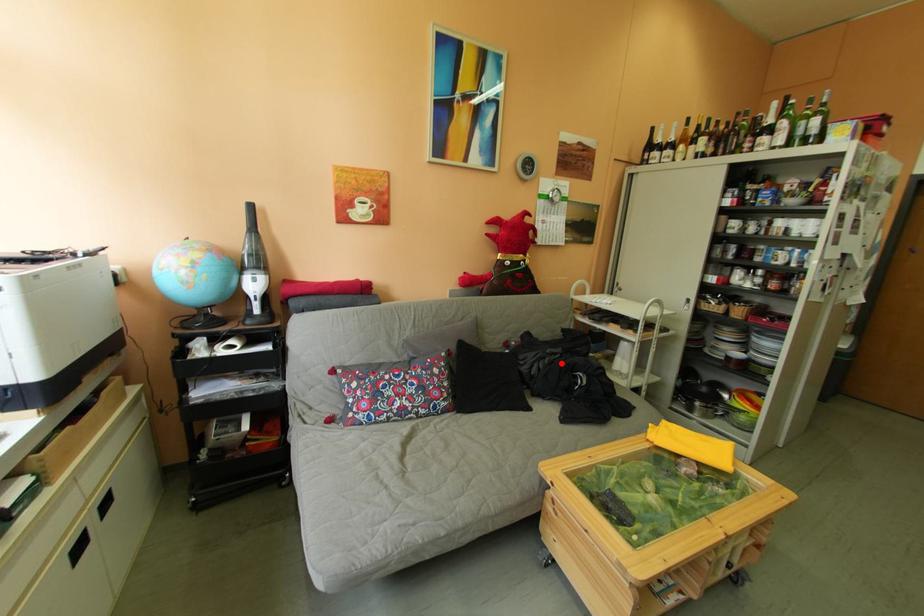
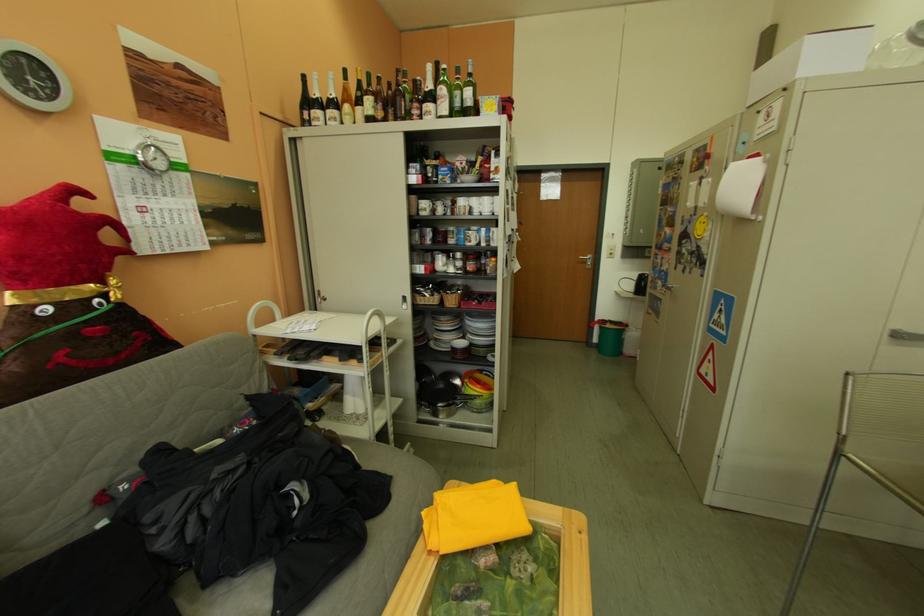
Where in the second image is the point corresponding to the highlighted location from the first image?

(234, 493)